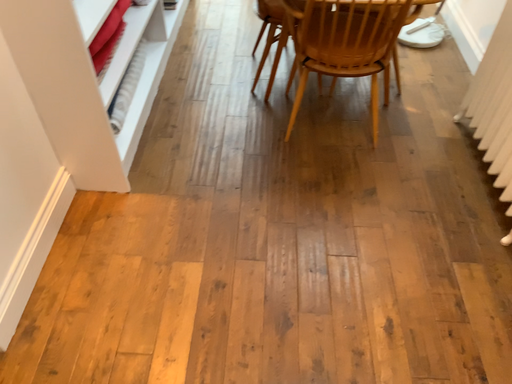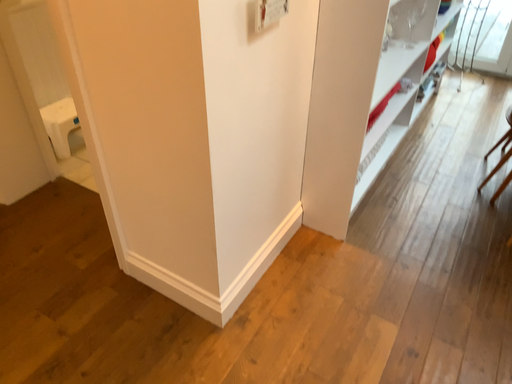
Question: Which way did the camera rotate in the video?

Choices:
 (A) rotated upward
 (B) rotated downward

Answer: (A)